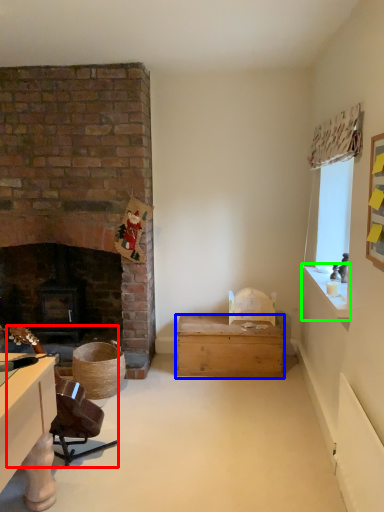
Question: Estimate the real-world distances between objects in this image. Which object is farther from swivel chair (highlighted by a red box), box (highlighted by a blue box) or window sill (highlighted by a green box)?

Choices:
 (A) box
 (B) window sill

Answer: (B)